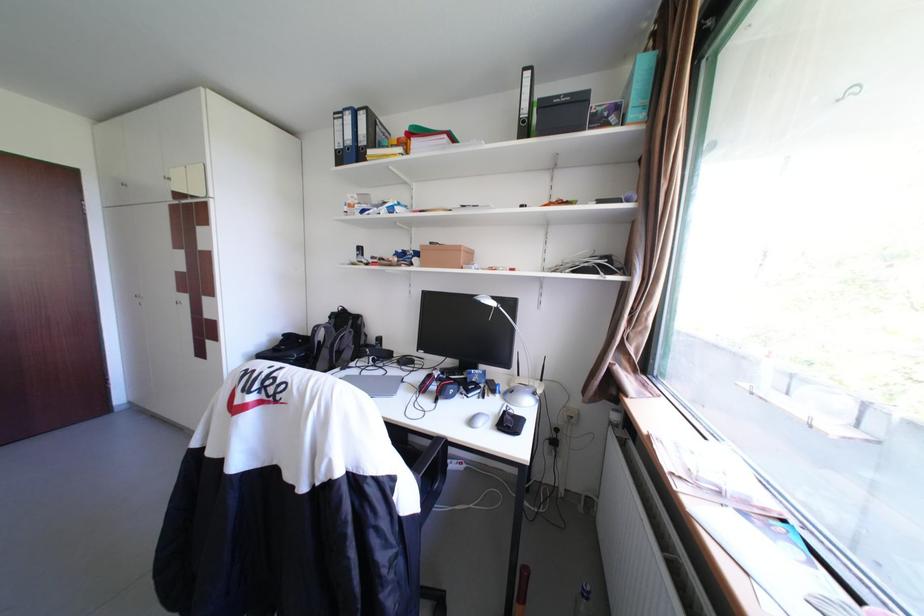
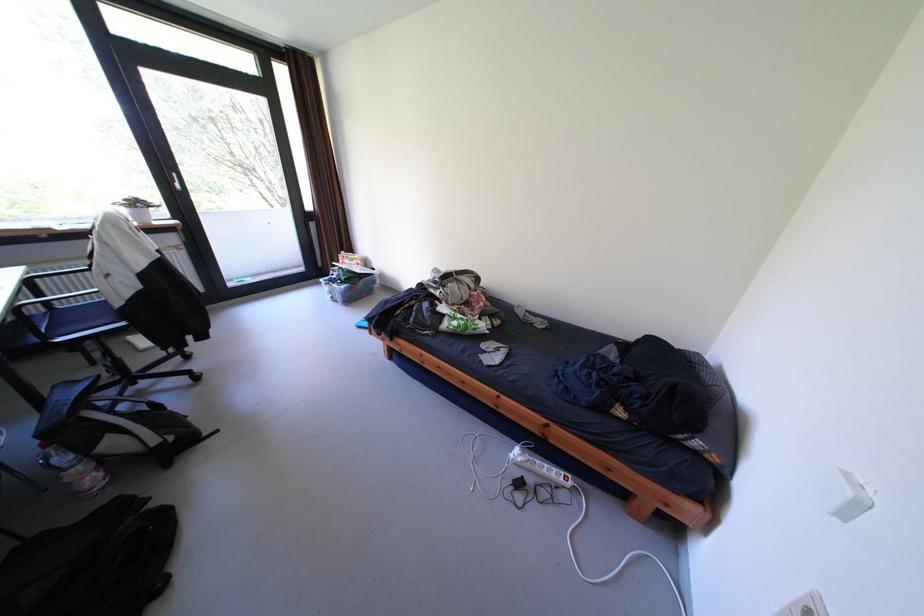
Question: I am providing you with two images of the same scene from different viewpoints. Please identify which objects are invisible in image2.

Choices:
 (A) Door handle
 (B) wooden baseball bat
 (C) white potted plant
 (D) white wall switch

Answer: (B)